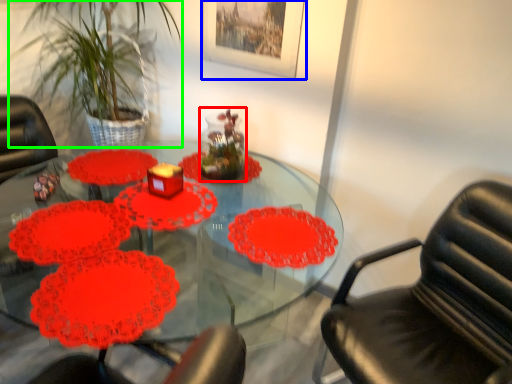
Question: Which object is positioned closest to glass vase (highlighted by a red box)? Select from picture frame (highlighted by a blue box) and plant (highlighted by a green box).

Choices:
 (A) picture frame
 (B) plant

Answer: (A)